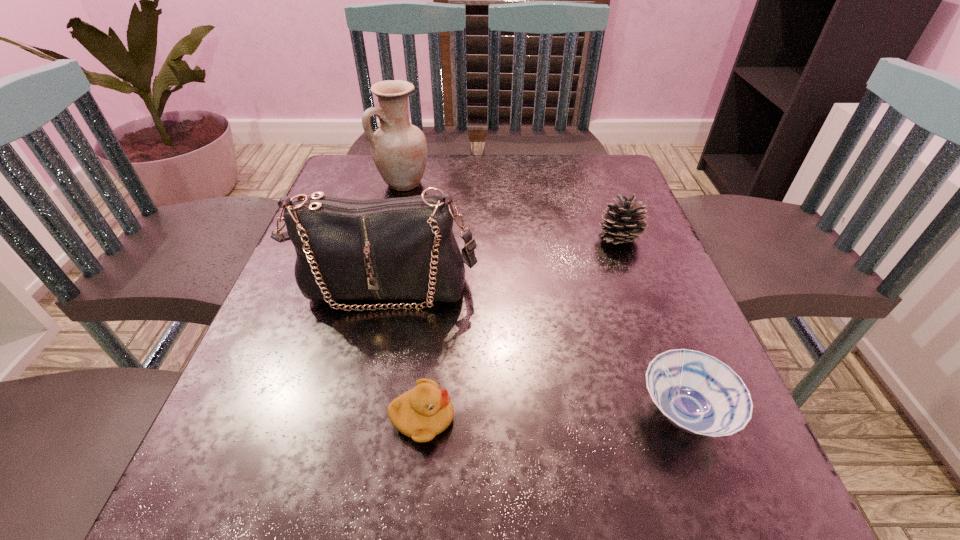
Where is `vacant region located on the back of the soup bowl`? The width and height of the screenshot is (960, 540). vacant region located on the back of the soup bowl is located at coordinates (614, 227).

This screenshot has height=540, width=960. In order to click on object at the far edge in this screenshot , I will do `click(399, 149)`.

The width and height of the screenshot is (960, 540). In order to click on pottery positioned at the left edge in this screenshot , I will do `click(399, 149)`.

Identify the location of handbag that is at the left edge. (404, 248).

Image resolution: width=960 pixels, height=540 pixels. Find the location of `pinecone that is at the right edge`. pinecone that is at the right edge is located at coordinates (623, 221).

I want to click on soup bowl at the right edge, so click(x=697, y=393).

The image size is (960, 540). Find the location of `object situated at the far left corner`. object situated at the far left corner is located at coordinates (399, 149).

The image size is (960, 540). Find the location of `vacant space at the far edge of the desktop`. vacant space at the far edge of the desktop is located at coordinates (455, 172).

In the image, there is a desktop. Identify the location of vacant region at the near edge. This screenshot has height=540, width=960. (629, 493).

The height and width of the screenshot is (540, 960). What are the coordinates of `vacant region at the left edge of the desktop` in the screenshot? It's located at pyautogui.click(x=280, y=310).